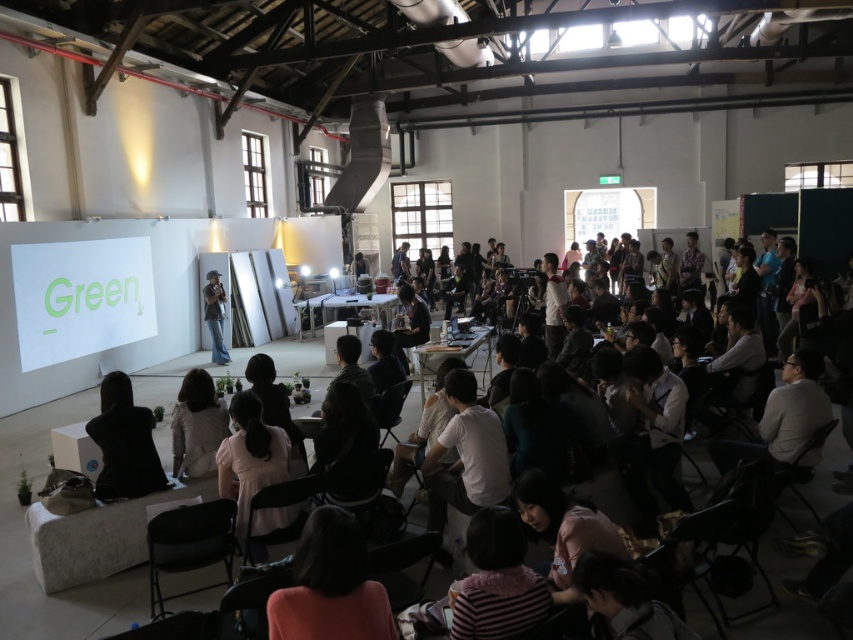
Question: Does light brown fabric jacket at lower center appear on the right side of dark gray fabric jacket at center?

Choices:
 (A) no
 (B) yes

Answer: (A)

Question: Among these objects, which one is farthest from the camera?

Choices:
 (A) black fabric at lower left
 (B) denim jeans at center

Answer: (B)

Question: Which of the following is the farthest from the observer?

Choices:
 (A) pink fabric at lower center
 (B) black fabric at lower left

Answer: (B)

Question: Is white fabric shirt at center wider than black fabric at lower left?

Choices:
 (A) no
 (B) yes

Answer: (B)

Question: Among these points, which one is farthest from the camera?

Choices:
 (A) (363, 452)
 (B) (207, 288)
 (C) (285, 467)
 (D) (213, 445)

Answer: (B)

Question: Is white fabric shirt at center further to the viewer compared to dark gray fabric jacket at center?

Choices:
 (A) yes
 (B) no

Answer: (B)